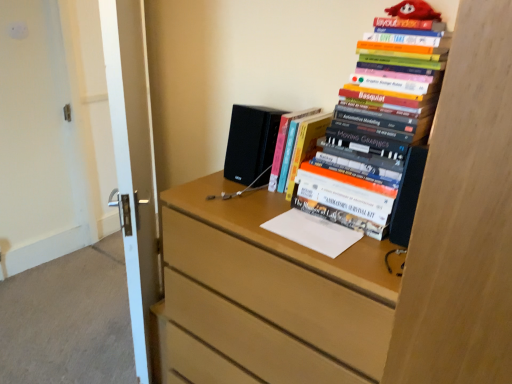
This screenshot has height=384, width=512. In order to click on vacant space situated on the left part of white glossy door at left in this screenshot , I will do `click(72, 331)`.